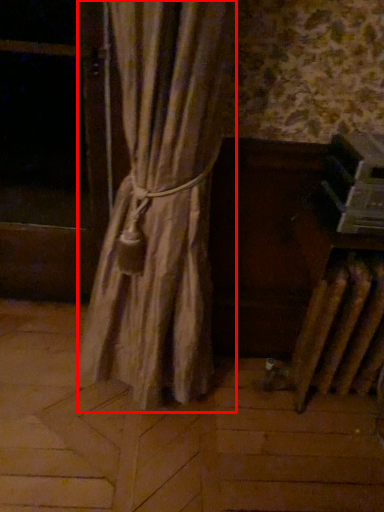
Question: Considering the relative positions of curtain (annotated by the red box) and window screen in the image provided, where is curtain (annotated by the red box) located with respect to the staircase?

Choices:
 (A) left
 (B) right

Answer: (B)